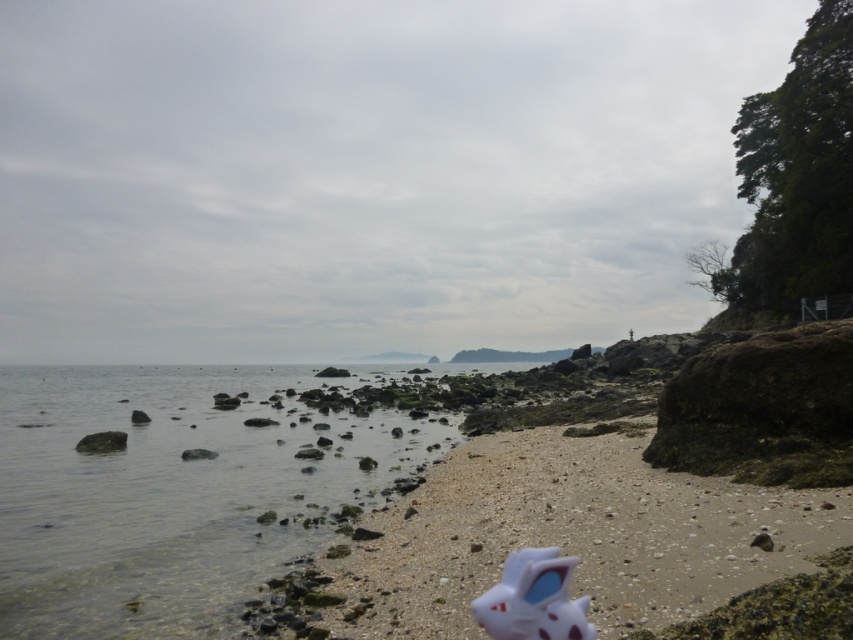
Question: Observing the image, what is the correct spatial positioning of clear water at beach left in reference to white matte toy at lower center?

Choices:
 (A) above
 (B) below

Answer: (B)

Question: Does clear water at beach left appear under white matte toy at lower center?

Choices:
 (A) yes
 (B) no

Answer: (A)

Question: Is clear water at beach left positioned before white matte toy at lower center?

Choices:
 (A) no
 (B) yes

Answer: (A)